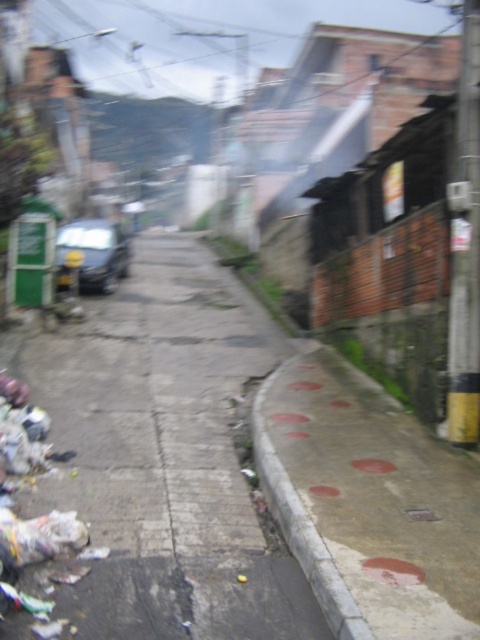
Consider the image. Is concrete sidewalk at center above concrete curb at lower right?

Correct, concrete sidewalk at center is located above concrete curb at lower right.

Between point (276, 355) and point (336, 609), which one is positioned in front?

Point (336, 609)

You are a GUI agent. You are given a task and a screenshot of the screen. Output one action in this format:
    pyautogui.click(x=<x>, y=<y>)
    Task: Click on the concrete sidewalk at center
    This screenshot has height=640, width=480.
    Given the screenshot: What is the action you would take?
    pyautogui.click(x=165, y=456)

Who is more distant from viewer, (x=100, y=364) or (x=24, y=557)?

Point (x=100, y=364)

In the scene shown: Is concrete sidewalk at center to the right of white plastic bag at lower left from the viewer's perspective?

Yes, concrete sidewalk at center is to the right of white plastic bag at lower left.

Measure the distance between concrete sidewalk at center and camera.

concrete sidewalk at center and camera are 3.33 meters apart from each other.

Where is `concrete sidewalk at center`? concrete sidewalk at center is located at coordinates (165, 456).

Is point (16, 602) in front of point (360, 620)?

No, it is behind (360, 620).

Where is `white plastic bag at lower left`? white plastic bag at lower left is located at coordinates (25, 483).